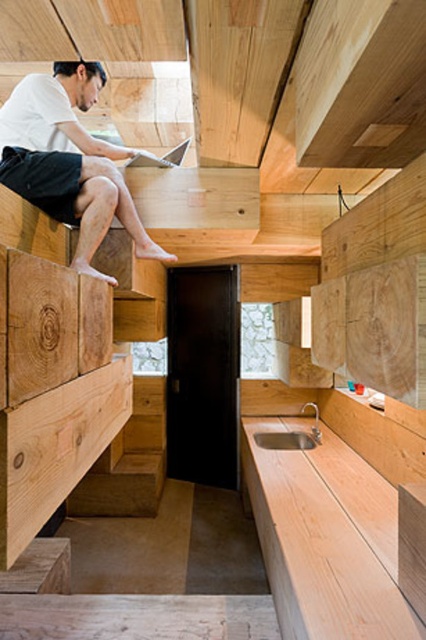
Question: Can you confirm if light wood/rough wooden surface at lower right is positioned above matte white shirt at upper left?

Choices:
 (A) yes
 (B) no

Answer: (B)

Question: Does light wood/rough wooden surface at lower right appear under matte white shirt at upper left?

Choices:
 (A) yes
 (B) no

Answer: (A)

Question: Can you confirm if light wood/rough wooden surface at lower right is positioned to the left of matte white shirt at upper left?

Choices:
 (A) no
 (B) yes

Answer: (A)

Question: Which point appears farthest from the camera in this image?

Choices:
 (A) (20, 124)
 (B) (319, 458)

Answer: (B)